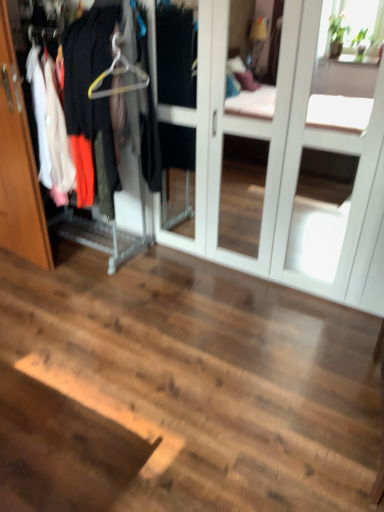
Locate an element on the screen. This screenshot has width=384, height=512. free space to the right of wooden door at left is located at coordinates (74, 256).